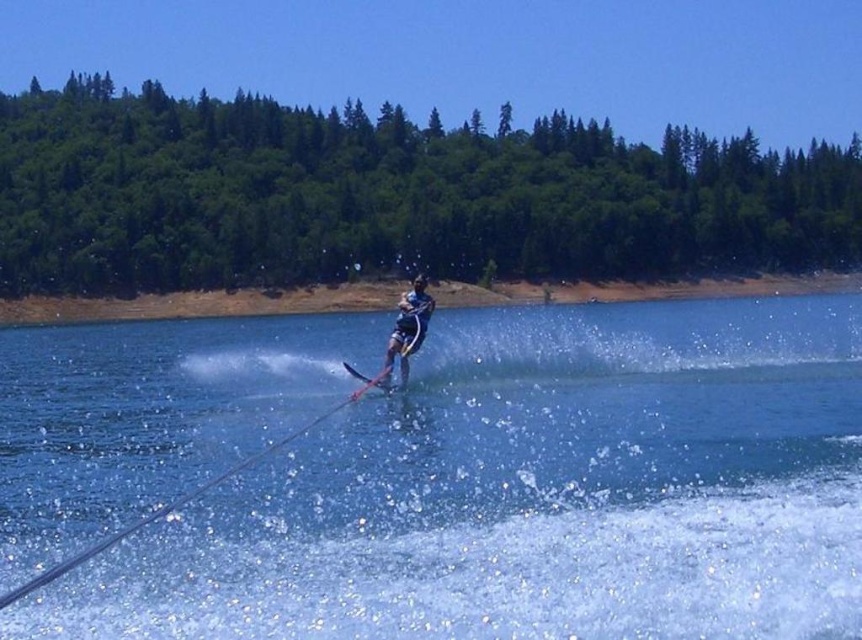
Can you confirm if green leafy trees at upper center is positioned to the left of shiny metallic ski at center?

No, green leafy trees at upper center is not to the left of shiny metallic ski at center.

Is green leafy trees at upper center bigger than shiny metallic ski at center?

Correct, green leafy trees at upper center is larger in size than shiny metallic ski at center.

Where is `green leafy trees at upper center`? green leafy trees at upper center is located at coordinates (388, 196).

The height and width of the screenshot is (640, 862). I want to click on green leafy trees at upper center, so click(388, 196).

Does green leafy trees at upper center come behind dark blue fabric wetsuit at center?

That is True.

Measure the distance from green leafy trees at upper center to dark blue fabric wetsuit at center.

They are 38.35 meters apart.

Does point (30, 259) come in front of point (403, 317)?

No, it is not.

Locate an element on the screen. This screenshot has width=862, height=640. green leafy trees at upper center is located at coordinates (388, 196).

Is clear blue water at center positioned before shiny metallic ski at center?

Yes, it is in front of shiny metallic ski at center.

Can you confirm if clear blue water at center is thinner than shiny metallic ski at center?

Incorrect, clear blue water at center's width is not less than shiny metallic ski at center's.

Which is in front, point (350, 564) or point (385, 378)?

Point (350, 564) is in front.

Find the location of a particular element. clear blue water at center is located at coordinates (531, 493).